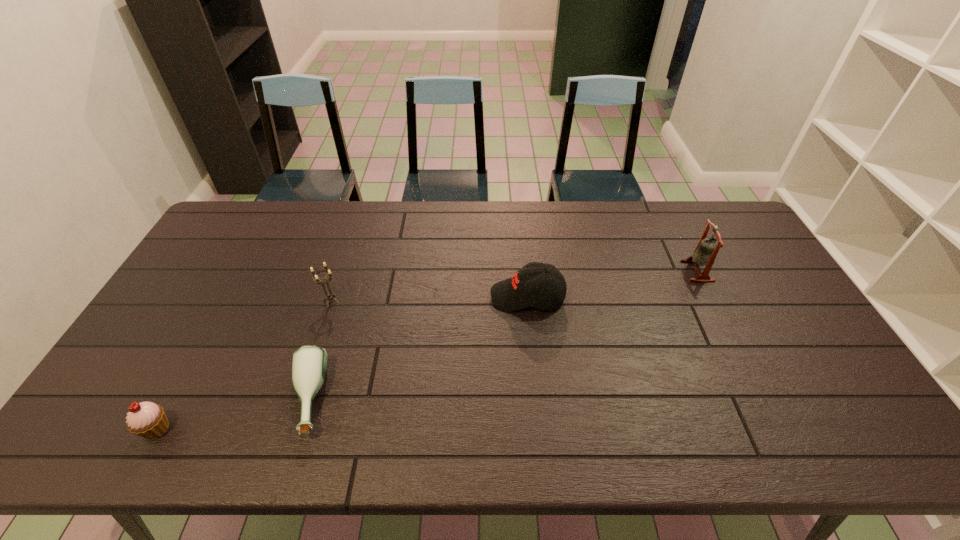
The height and width of the screenshot is (540, 960). In the image, there is a desktop. In order to click on vacant space at the far left corner in this screenshot , I will do `click(228, 216)`.

Image resolution: width=960 pixels, height=540 pixels. Find the location of `vacant space that's between the bottle and the baseball cap`. vacant space that's between the bottle and the baseball cap is located at coordinates (417, 348).

The width and height of the screenshot is (960, 540). Identify the location of vacant point located between the candle holder and the fourth object from left to right. (429, 299).

Find the location of a particular element. unoccupied area between the leftmost object and the bottle is located at coordinates (231, 414).

The height and width of the screenshot is (540, 960). What are the coordinates of `empty space that is in between the leftmost object and the shortest object` in the screenshot? It's located at (231, 414).

Locate an element on the screen. The width and height of the screenshot is (960, 540). free point between the baseball cap and the candle holder is located at coordinates (429, 299).

You are a GUI agent. You are given a task and a screenshot of the screen. Output one action in this format:
    pyautogui.click(x=<x>, y=<y>)
    Task: Click on the blank region between the candle holder and the cupcake
    
    Given the screenshot: What is the action you would take?
    pyautogui.click(x=244, y=365)

Find the location of a particular element. The height and width of the screenshot is (540, 960). free space between the cupcake and the candle holder is located at coordinates (244, 365).

Locate an element on the screen. The image size is (960, 540). empty space that is in between the fourth object from left to right and the rightmost object is located at coordinates 612,284.

You are a GUI agent. You are given a task and a screenshot of the screen. Output one action in this format:
    pyautogui.click(x=<x>, y=<y>)
    Task: Click on the object that is the second closest to the cupcake
    
    Given the screenshot: What is the action you would take?
    [328, 296]